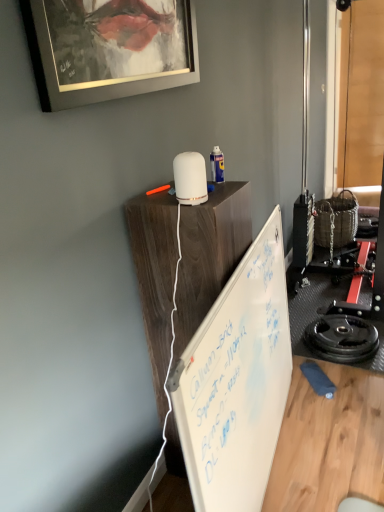
You are a GUI agent. You are given a task and a screenshot of the screen. Output one action in this format:
    pyautogui.click(x=<x>, y=<y>)
    Task: Click on the blank space above black rubber weight plate at lower right (from a real-world perspective)
    The height and width of the screenshot is (512, 384).
    Given the screenshot: What is the action you would take?
    pyautogui.click(x=349, y=334)